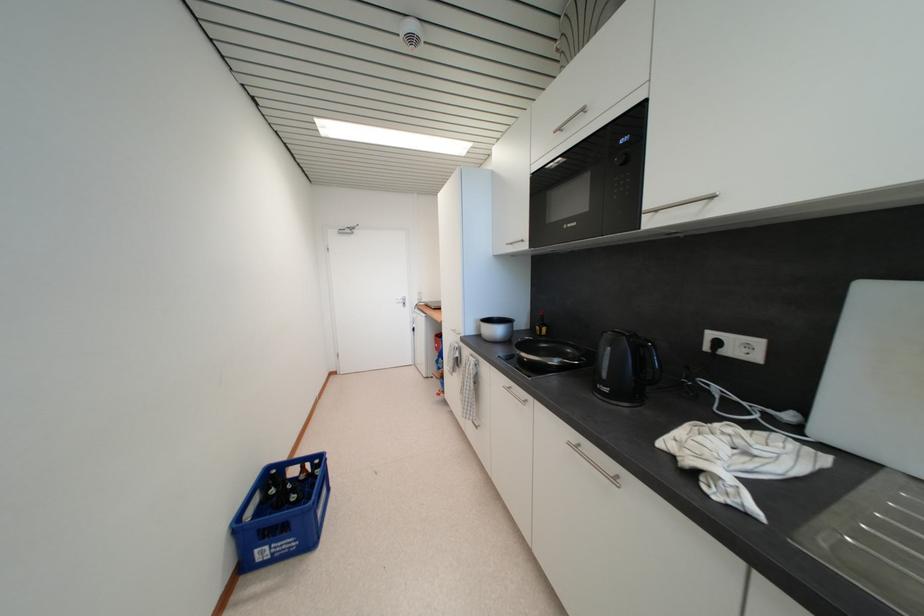
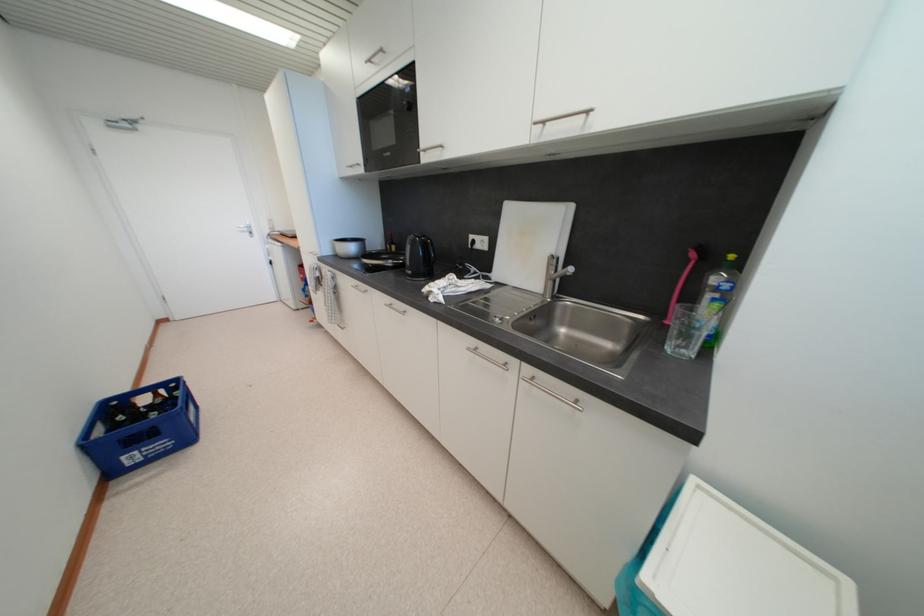
Where in the second image is the point corresponding to (565,132) from the first image?

(375, 63)